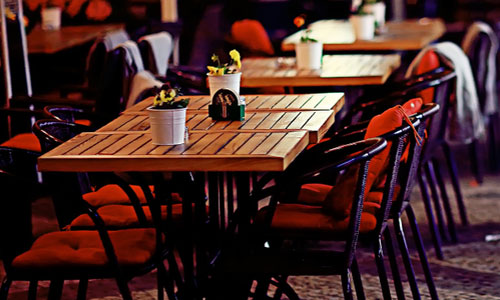
This screenshot has height=300, width=500. I want to click on tables, so click(257, 142), click(275, 115), click(293, 97), click(341, 58), click(394, 25).